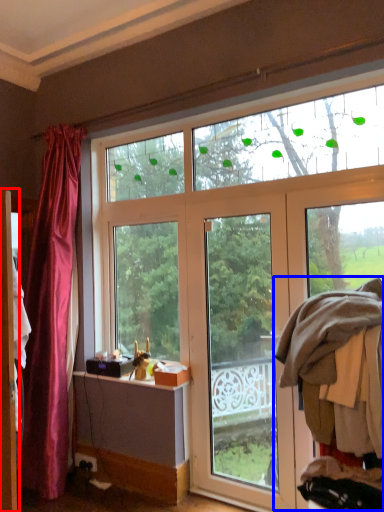
Question: Which object is closer to the camera taking this photo, screen door (highlighted by a red box) or laundry (highlighted by a blue box)?

Choices:
 (A) screen door
 (B) laundry

Answer: (B)